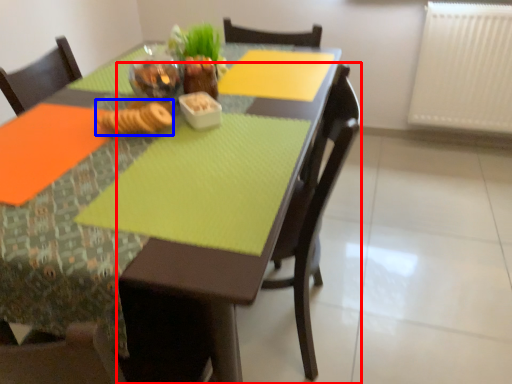
Question: Which object is closer to the camera taking this photo, chair (highlighted by a red box) or food (highlighted by a blue box)?

Choices:
 (A) chair
 (B) food

Answer: (A)